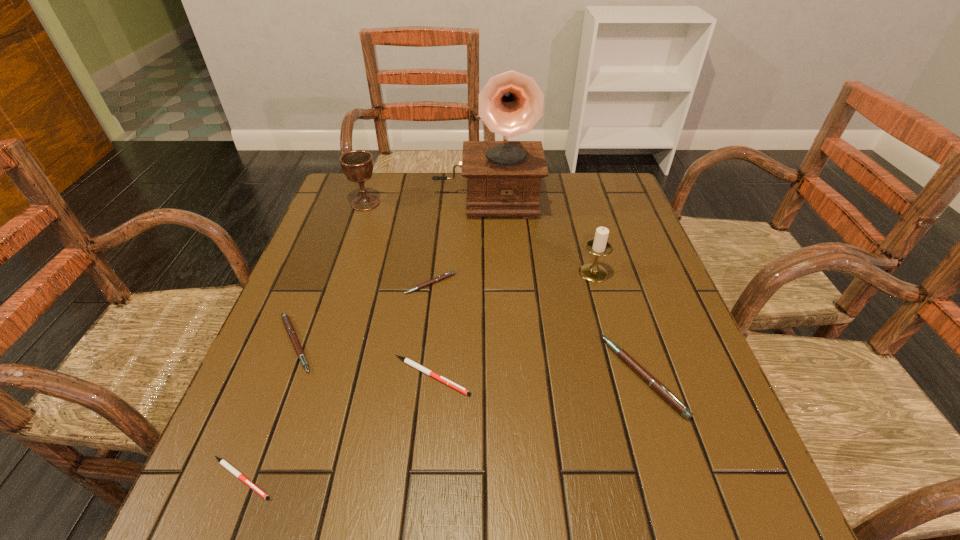
Find the location of a particular element. The height and width of the screenshot is (540, 960). free spot located at the nib of the fourth shortest object is located at coordinates (348, 343).

Where is `free space located 0.290m at the nib of the smallest pink pen`? free space located 0.290m at the nib of the smallest pink pen is located at coordinates (416, 406).

Identify the location of vacant area located 0.240m on the clicker of the bigger white pen. The width and height of the screenshot is (960, 540). (594, 376).

You are a GUI agent. You are given a task and a screenshot of the screen. Output one action in this format:
    pyautogui.click(x=<x>, y=<y>)
    Task: Click on the vacant space located on the clicker of the nearest pen
    
    Given the screenshot: What is the action you would take?
    pyautogui.click(x=436, y=478)

Identify the location of record player present at the far edge. (504, 177).

What are the coordinates of `chalice present at the far edge` in the screenshot? It's located at (357, 165).

At what (x,y) coordinates should I click in order to perform the action: click on object positioned at the near edge. Please return your answer as a coordinate pair (x, y). This screenshot has width=960, height=540. Looking at the image, I should click on (230, 468).

At what (x,y) coordinates should I click in order to perform the action: click on chalice at the left edge. Please return your answer as a coordinate pair (x, y). The image size is (960, 540). Looking at the image, I should click on click(x=357, y=165).

You are a GUI agent. You are given a task and a screenshot of the screen. Output one action in this format:
    pyautogui.click(x=<x>, y=<y>)
    Task: Click on the candle holder located in the right edge section of the desktop
    
    Given the screenshot: What is the action you would take?
    pyautogui.click(x=599, y=246)

What are the coordinates of `pen that is at the right edge` in the screenshot? It's located at tap(655, 384).